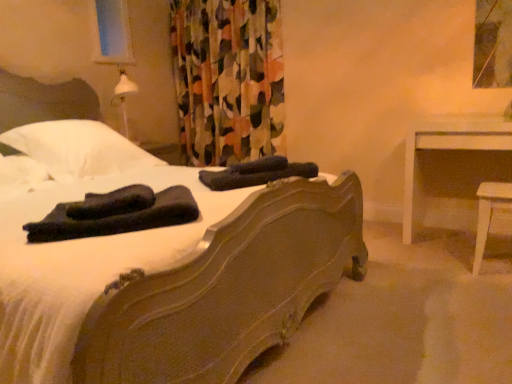
This screenshot has width=512, height=384. Describe the element at coordinates (256, 173) in the screenshot. I see `dark blue fabric at center, which is the first material from back to front` at that location.

What do you see at coordinates (448, 148) in the screenshot?
I see `white glossy table at right` at bounding box center [448, 148].

Where is `white glossy table at right`? white glossy table at right is located at coordinates (489, 214).

What is the approximate height of white glossy table at right?

white glossy table at right is 45.31 centimeters in height.

The height and width of the screenshot is (384, 512). What are the coordinates of `floral fabric curtain at upper center` in the screenshot? It's located at (228, 79).

Considering the sizes of objects brown wooden bed at center and white glossy table at right in the image provided, who is thinner, brown wooden bed at center or white glossy table at right?

white glossy table at right.

Is brown wooden bed at center bigger than white glossy table at right?

Correct, brown wooden bed at center is larger in size than white glossy table at right.

Which is farther, [81,241] or [445,119]?

The point [445,119] is behind.

Considering the positions of objects brown wooden bed at center and white glossy table at right in the image provided, who is more to the left, brown wooden bed at center or white glossy table at right?

brown wooden bed at center is more to the left.

Is black fabric at bed, arranged as the 1th material when viewed from the left, positioned with its back to white glossy table at right?

black fabric at bed, arranged as the 1th material when viewed from the left, does not have its back to white glossy table at right.

Between black fabric at bed, the 2th material viewed from the back, and white glossy table at right, which one has smaller width?

With smaller width is white glossy table at right.

Which is less distant, [166,193] or [493,200]?

Point [166,193] appears to be closer to the viewer than point [493,200].

Can you confirm if black fabric at bed, arranged as the first material when viewed from the front, is positioned to the right of white glossy table at right?

In fact, black fabric at bed, arranged as the first material when viewed from the front, is to the left of white glossy table at right.

Can you tell me how much white soft pillow at left and white glossy table at right differ in facing direction?

white soft pillow at left and white glossy table at right are facing 90.3 degrees away from each other.

Is white soft pillow at left wider or thinner than white glossy table at right?

Considering their sizes, white soft pillow at left looks broader than white glossy table at right.

Looking at this image, from a real-world perspective, who is located lower, white soft pillow at left or white glossy table at right?

white glossy table at right.

Is white glossy table at right inside white soft pillow at left?

That's incorrect, white glossy table at right is not inside white soft pillow at left.

Can you confirm if white soft pillow at left is wider than dark blue fabric at center, marked as the first material in a right-to-left arrangement?

Yes, white soft pillow at left is wider than dark blue fabric at center, marked as the first material in a right-to-left arrangement.

From a real-world perspective, is white soft pillow at left above or below dark blue fabric at center, marked as the 2th material in a bottom-to-top arrangement?

white soft pillow at left is situated higher than dark blue fabric at center, marked as the 2th material in a bottom-to-top arrangement, in the real world.

Is white soft pillow at left next to dark blue fabric at center, marked as the first material in a right-to-left arrangement?

No, white soft pillow at left is not touching dark blue fabric at center, marked as the first material in a right-to-left arrangement.

From the image's perspective, is white soft pillow at left located above dark blue fabric at center, marked as the first material in a right-to-left arrangement?

Indeed, from the image's perspective, white soft pillow at left is shown above dark blue fabric at center, marked as the first material in a right-to-left arrangement.

Is floral fabric curtain at upper center bigger than white glossy table at right?

Yes, floral fabric curtain at upper center is bigger than white glossy table at right.

Does point (220, 160) appear closer or farther from the camera than point (479, 144)?

Point (220, 160) appears to be farther away from the viewer than point (479, 144).

From the image's perspective, which one is positioned lower, floral fabric curtain at upper center or white glossy table at right?

white glossy table at right, from the image's perspective.

Is floral fabric curtain at upper center looking in the opposite direction of white soft pillow at left?

No.

Is floral fabric curtain at upper center to the right of white soft pillow at left from the viewer's perspective?

Yes, floral fabric curtain at upper center is to the right of white soft pillow at left.

Can you tell me how much floral fabric curtain at upper center and white soft pillow at left differ in facing direction?

The angular difference between floral fabric curtain at upper center and white soft pillow at left is 87.3 degrees.

Which object is wider, floral fabric curtain at upper center or white soft pillow at left?

white soft pillow at left.

Considering the sizes of objects dark blue fabric at center, marked as the 2th material in a bottom-to-top arrangement, and white glossy table at right in the image provided, who is thinner, dark blue fabric at center, marked as the 2th material in a bottom-to-top arrangement, or white glossy table at right?

white glossy table at right is thinner.

In the scene shown: Between dark blue fabric at center, marked as the 2th material in a bottom-to-top arrangement, and white glossy table at right, which one has more height?

white glossy table at right.

Is dark blue fabric at center, which is the first material from back to front, facing towards white glossy table at right?

No, dark blue fabric at center, which is the first material from back to front, is not facing towards white glossy table at right.

Would you consider dark blue fabric at center, the second material positioned from the left, to be distant from white glossy table at right?

No, there isn't a large distance between dark blue fabric at center, the second material positioned from the left, and white glossy table at right.

Identify the location of nightstand on the right of brown wooden bed at center. This screenshot has width=512, height=384. (448, 148).

Identify the location of material that is the 2nd one when counting forward from the white glossy table at right. Image resolution: width=512 pixels, height=384 pixels. (116, 214).

Estimate the real-world distances between objects in this image. Which object is further from white glossy table at right, black fabric at bed, which is the 2th material in right-to-left order, or floral fabric curtain at upper center?

black fabric at bed, which is the 2th material in right-to-left order.

Looking at the image, which one is located further to floral fabric curtain at upper center, black fabric at bed, the 2th material viewed from the back, or dark blue fabric at center, marked as the first material in a right-to-left arrangement?

The object further to floral fabric curtain at upper center is black fabric at bed, the 2th material viewed from the back.

Based on their spatial positions, is white glossy table at right or black fabric at bed, which is the 2th material in right-to-left order, closer to brown wooden bed at center?

Among the two, black fabric at bed, which is the 2th material in right-to-left order, is located nearer to brown wooden bed at center.

Considering their positions, is white soft pillow at left positioned closer to black fabric at bed, arranged as the 1th material when viewed from the left, than dark blue fabric at center, marked as the 2th material in a bottom-to-top arrangement?

Based on the image, dark blue fabric at center, marked as the 2th material in a bottom-to-top arrangement, appears to be nearer to black fabric at bed, arranged as the 1th material when viewed from the left.

Which object lies nearer to the anchor point dark blue fabric at center, acting as the second material starting from the front, white glossy table at right or brown wooden bed at center?

brown wooden bed at center lies closer to dark blue fabric at center, acting as the second material starting from the front, than the other object.

Based on their spatial positions, is brown wooden bed at center or floral fabric curtain at upper center further from white soft pillow at left?

The object further to white soft pillow at left is floral fabric curtain at upper center.

Which object lies nearer to the anchor point floral fabric curtain at upper center, white glossy table at right or dark blue fabric at center, acting as the second material starting from the front?

white glossy table at right.

Which object lies nearer to the anchor point white glossy table at right, white soft pillow at left or dark blue fabric at center, the second material positioned from the left?

dark blue fabric at center, the second material positioned from the left, lies closer to white glossy table at right than the other object.

This screenshot has width=512, height=384. I want to click on bed located between white soft pillow at left and white glossy table at right in the left-right direction, so click(155, 261).

Where is `bed between white soft pillow at left and white glossy table at right from left to right`? bed between white soft pillow at left and white glossy table at right from left to right is located at coordinates (155, 261).

I want to click on table between brown wooden bed at center and white glossy table at right in the horizontal direction, so click(489, 214).

This screenshot has height=384, width=512. In order to click on table between brown wooden bed at center and floral fabric curtain at upper center from front to back in this screenshot , I will do `click(489, 214)`.